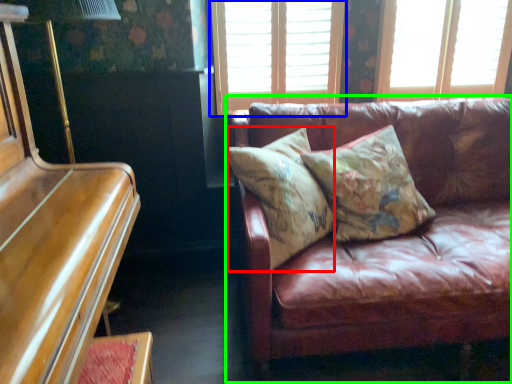
Question: Which is farther away from pillow (highlighted by a red box)? window (highlighted by a blue box) or studio couch (highlighted by a green box)?

Choices:
 (A) window
 (B) studio couch

Answer: (A)